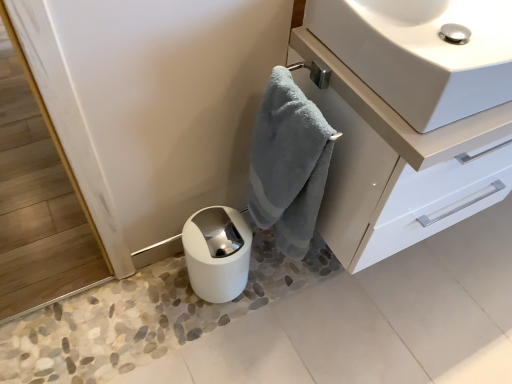
Image resolution: width=512 pixels, height=384 pixels. I want to click on white glossy paper towel at lower center, so click(x=217, y=253).

Considering the positions of points (234, 279) and (400, 27), is point (234, 279) farther from camera compared to point (400, 27)?

Yes, it is behind point (400, 27).

Can you confirm if white glossy paper towel at lower center is taller than white glossy sink at upper right?

Yes, white glossy paper towel at lower center is taller than white glossy sink at upper right.

Between white glossy paper towel at lower center and white glossy sink at upper right, which one has smaller size?

white glossy paper towel at lower center.

I want to click on sink in front of the white glossy paper towel at lower center, so click(421, 53).

Based on the photo, does white glossy sink at upper right come behind glossy white cabinet at upper right?

No, white glossy sink at upper right is in front of glossy white cabinet at upper right.

Considering the positions of point (414, 28) and point (374, 174), is point (414, 28) closer or farther from the camera than point (374, 174)?

Point (414, 28) appears to be farther away from the viewer than point (374, 174).

Is white glossy sink at upper right positioned beyond the bounds of glossy white cabinet at upper right?

Yes.

Is white glossy sink at upper right taller or shorter than glossy white cabinet at upper right?

Clearly, white glossy sink at upper right is shorter compared to glossy white cabinet at upper right.

Is white glossy sink at upper right completely or partially outside of soft blue towel at center?

Yes.

Are white glossy sink at upper right and soft blue towel at center making contact?

No, white glossy sink at upper right is not touching soft blue towel at center.

From the image's perspective, would you say white glossy sink at upper right is shown under soft blue towel at center?

No.

Is glossy white cabinet at upper right a part of white glossy paper towel at lower center?

No.

Locate an element on the screen. The image size is (512, 384). bathroom cabinet located above the white glossy paper towel at lower center (from the image's perspective) is located at coordinates (398, 165).

Is white glossy paper towel at lower center in front of or behind glossy white cabinet at upper right in the image?

Clearly, white glossy paper towel at lower center is behind glossy white cabinet at upper right.

Looking at this image, considering the relative sizes of white glossy paper towel at lower center and glossy white cabinet at upper right in the image provided, is white glossy paper towel at lower center wider than glossy white cabinet at upper right?

No.

What's the angular difference between white glossy sink at upper right and white glossy paper towel at lower center's facing directions?

The angular difference between white glossy sink at upper right and white glossy paper towel at lower center is 0.552 degrees.

Considering the relative positions of white glossy sink at upper right and white glossy paper towel at lower center in the image provided, is white glossy sink at upper right to the left of white glossy paper towel at lower center from the viewer's perspective?

Incorrect, white glossy sink at upper right is not on the left side of white glossy paper towel at lower center.

Does white glossy sink at upper right lie in front of white glossy paper towel at lower center?

Yes, white glossy sink at upper right is in front of white glossy paper towel at lower center.

Which is in front, point (434, 32) or point (231, 233)?

The point (434, 32) is closer to the camera.

From the image's perspective, which one is positioned higher, glossy white cabinet at upper right or white glossy paper towel at lower center?

glossy white cabinet at upper right.

Who is taller, glossy white cabinet at upper right or white glossy paper towel at lower center?

glossy white cabinet at upper right is taller.

Looking at this image, would you say glossy white cabinet at upper right is inside or outside white glossy paper towel at lower center?

glossy white cabinet at upper right is located beyond the bounds of white glossy paper towel at lower center.

Is soft blue towel at center wider than white glossy sink at upper right?

No.

In the scene shown: From a real-world perspective, is soft blue towel at center above or below white glossy sink at upper right?

soft blue towel at center is situated lower than white glossy sink at upper right in the real world.

Who is taller, soft blue towel at center or white glossy sink at upper right?

With more height is soft blue towel at center.

Are soft blue towel at center and white glossy sink at upper right far apart?

No, soft blue towel at center is not far from white glossy sink at upper right.

This screenshot has width=512, height=384. I want to click on sink lying on the right of white glossy paper towel at lower center, so click(x=421, y=53).

I want to click on sink above the glossy white cabinet at upper right (from a real-world perspective), so click(x=421, y=53).

Considering their positions, is white glossy paper towel at lower center positioned further to glossy white cabinet at upper right than soft blue towel at center?

white glossy paper towel at lower center.

Considering their positions, is glossy white cabinet at upper right positioned further to white glossy sink at upper right than white glossy paper towel at lower center?

Among the two, white glossy paper towel at lower center is located further to white glossy sink at upper right.

Which object lies further to the anchor point white glossy sink at upper right, soft blue towel at center or glossy white cabinet at upper right?

Based on the image, soft blue towel at center appears to be further to white glossy sink at upper right.

Considering their positions, is glossy white cabinet at upper right positioned closer to soft blue towel at center than white glossy paper towel at lower center?

Based on the image, glossy white cabinet at upper right appears to be nearer to soft blue towel at center.

When comparing their distances from soft blue towel at center, does white glossy paper towel at lower center or white glossy sink at upper right seem closer?

white glossy paper towel at lower center lies closer to soft blue towel at center than the other object.

Estimate the real-world distances between objects in this image. Which object is closer to soft blue towel at center, white glossy sink at upper right or glossy white cabinet at upper right?

The object closer to soft blue towel at center is glossy white cabinet at upper right.

In the scene shown: Which object lies nearer to the anchor point white glossy paper towel at lower center, glossy white cabinet at upper right or soft blue towel at center?

soft blue towel at center lies closer to white glossy paper towel at lower center than the other object.

When comparing their distances from white glossy sink at upper right, does soft blue towel at center or white glossy paper towel at lower center seem further?

Among the two, white glossy paper towel at lower center is located further to white glossy sink at upper right.

This screenshot has width=512, height=384. I want to click on sink between soft blue towel at center and glossy white cabinet at upper right in the horizontal direction, so click(421, 53).

Identify the location of bath towel between white glossy sink at upper right and white glossy paper towel at lower center from top to bottom. The image size is (512, 384). point(288,164).

Where is `bath towel between white glossy paper towel at lower center and glossy white cabinet at upper right`? bath towel between white glossy paper towel at lower center and glossy white cabinet at upper right is located at coordinates (288, 164).

You are a GUI agent. You are given a task and a screenshot of the screen. Output one action in this format:
    pyautogui.click(x=<x>, y=<y>)
    Task: Click on the sink between white glossy paper towel at lower center and glossy white cabinet at upper right from left to right
    
    Given the screenshot: What is the action you would take?
    pyautogui.click(x=421, y=53)